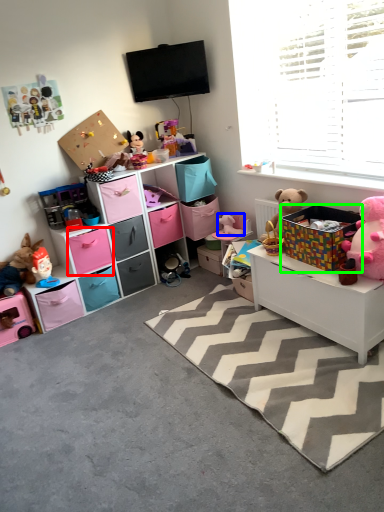
Question: Which object is positioned closest to drawer (highlighted by a red box)? Select from toy (highlighted by a blue box) and storage box (highlighted by a green box).

Choices:
 (A) toy
 (B) storage box

Answer: (A)